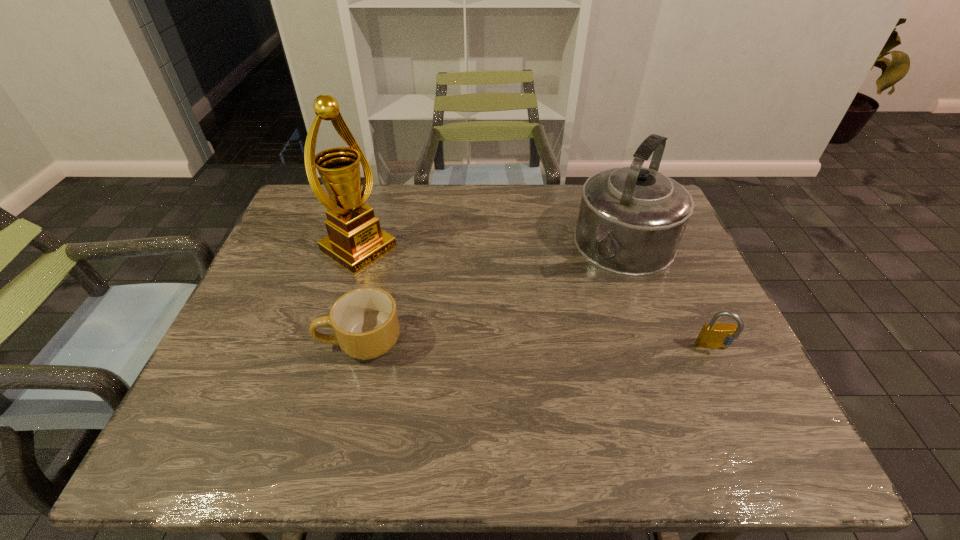
You are a GUI agent. You are given a task and a screenshot of the screen. Output one action in this format:
    pyautogui.click(x=<x>, y=<y>)
    Task: Click on the vacant area situated on the front-facing side of the tallest object
    
    Given the screenshot: What is the action you would take?
    pyautogui.click(x=439, y=301)

Where is `free space located with the spout at the front of the kettle`? The image size is (960, 540). free space located with the spout at the front of the kettle is located at coordinates (561, 337).

Where is `vacant space located with the spout at the front of the kettle`? The width and height of the screenshot is (960, 540). vacant space located with the spout at the front of the kettle is located at coordinates (529, 378).

Image resolution: width=960 pixels, height=540 pixels. Identify the location of blank space located 0.360m with the spout at the front of the kettle. (534, 372).

You are a GUI agent. You are given a task and a screenshot of the screen. Output one action in this format:
    pyautogui.click(x=<x>, y=<y>)
    Task: Click on the award that is at the far edge
    The height and width of the screenshot is (540, 960).
    Given the screenshot: What is the action you would take?
    pyautogui.click(x=355, y=239)

Locate an element on the screen. kettle positioned at the far edge is located at coordinates pos(631,220).

Locate an element on the screen. object that is at the left edge is located at coordinates (355, 239).

Where is `padlock located in the right edge section of the desktop`? The width and height of the screenshot is (960, 540). padlock located in the right edge section of the desktop is located at coordinates (714, 335).

This screenshot has height=540, width=960. I want to click on kettle that is at the right edge, so click(631, 220).

At what (x,y) coordinates should I click in order to perform the action: click on object present at the far left corner. Please return your answer as a coordinate pair (x, y). This screenshot has height=540, width=960. Looking at the image, I should click on [x=355, y=239].